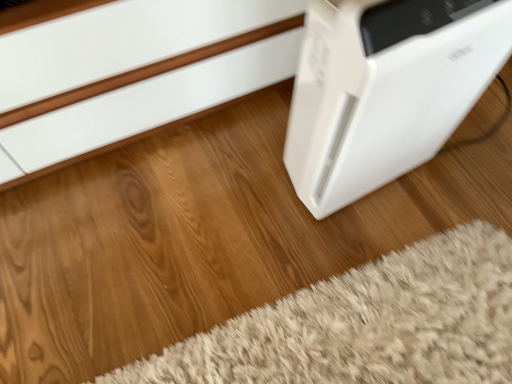
Question: From a real-world perspective, is white fluffy rug at lower right on top of white plastic air purifier at right?

Choices:
 (A) no
 (B) yes

Answer: (A)

Question: Does white fluffy rug at lower right have a lesser width compared to white plastic air purifier at right?

Choices:
 (A) yes
 (B) no

Answer: (B)

Question: Is white fluffy rug at lower right wider than white plastic air purifier at right?

Choices:
 (A) yes
 (B) no

Answer: (A)

Question: Does white fluffy rug at lower right have a smaller size compared to white plastic air purifier at right?

Choices:
 (A) no
 (B) yes

Answer: (B)

Question: Does white fluffy rug at lower right appear on the right side of white plastic air purifier at right?

Choices:
 (A) no
 (B) yes

Answer: (A)

Question: Would you say white fluffy rug at lower right is outside white plastic air purifier at right?

Choices:
 (A) no
 (B) yes

Answer: (B)

Question: Is white plastic air purifier at right further to the viewer compared to white fluffy rug at lower right?

Choices:
 (A) no
 (B) yes

Answer: (A)

Question: Considering the relative positions of white plastic air purifier at right and white fluffy rug at lower right in the image provided, is white plastic air purifier at right in front of white fluffy rug at lower right?

Choices:
 (A) yes
 (B) no

Answer: (A)

Question: Is white plastic air purifier at right outside white fluffy rug at lower right?

Choices:
 (A) no
 (B) yes

Answer: (B)

Question: Is white fluffy rug at lower right located within white plastic air purifier at right?

Choices:
 (A) yes
 (B) no

Answer: (B)

Question: Does white plastic air purifier at right have a smaller size compared to white fluffy rug at lower right?

Choices:
 (A) no
 (B) yes

Answer: (A)

Question: From the image's perspective, is white plastic air purifier at right below white fluffy rug at lower right?

Choices:
 (A) yes
 (B) no

Answer: (B)

Question: In the image, is white plastic air purifier at right on the left side or the right side of white fluffy rug at lower right?

Choices:
 (A) right
 (B) left

Answer: (A)